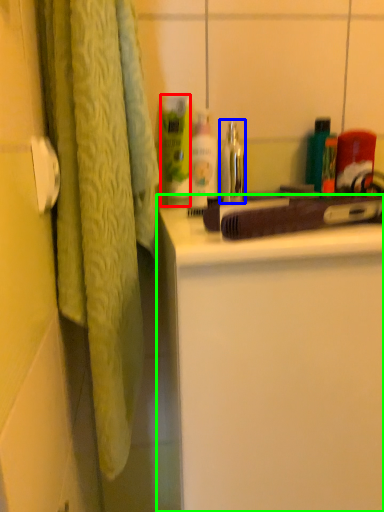
Question: Considering the real-world distances, which object is farthest from cleaning product (highlighted by a red box)? faucet (highlighted by a blue box) or bathroom cabinet (highlighted by a green box)?

Choices:
 (A) faucet
 (B) bathroom cabinet

Answer: (B)